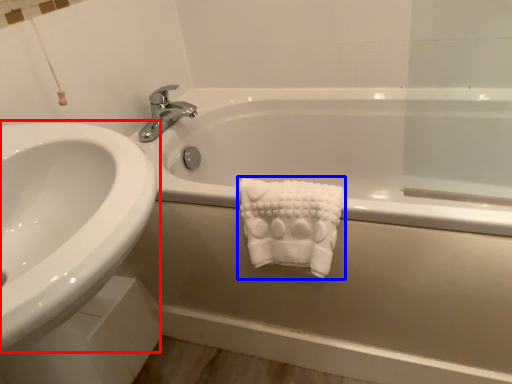
Question: Which object appears farthest to the camera in this image, sink (highlighted by a red box) or bath towel (highlighted by a blue box)?

Choices:
 (A) sink
 (B) bath towel

Answer: (B)